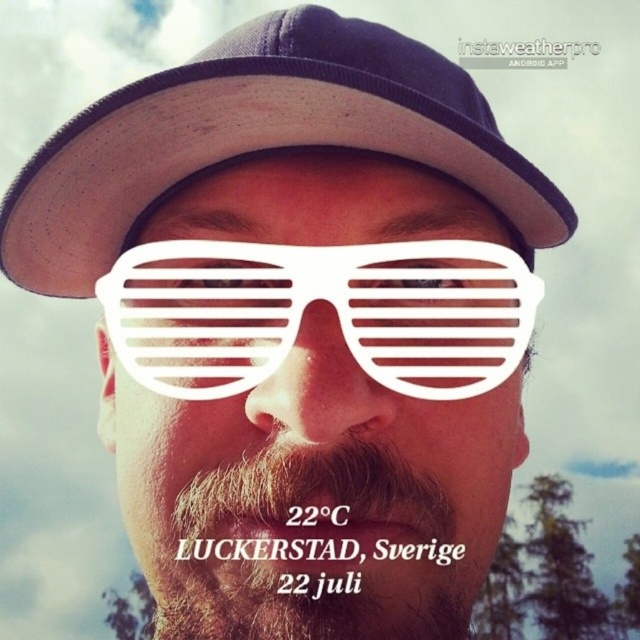
Question: Does dark blue fabric baseball hat at upper center have a lesser width compared to brownwoollybeard at lower center?

Choices:
 (A) yes
 (B) no

Answer: (B)

Question: Is dark blue fabric baseball hat at upper center to the right of white plastic sunglasses at center from the viewer's perspective?

Choices:
 (A) no
 (B) yes

Answer: (A)

Question: Observing the image, what is the correct spatial positioning of dark blue fabric baseball hat at upper center in reference to white plastic sunglasses at center?

Choices:
 (A) below
 (B) above

Answer: (B)

Question: Considering the real-world distances, which object is farthest from the brownwoollybeard at lower center?

Choices:
 (A) white plastic sunglasses at center
 (B) dark blue fabric baseball hat at upper center

Answer: (B)

Question: Among these objects, which one is farthest from the camera?

Choices:
 (A) dark blue fabric baseball hat at upper center
 (B) brownwoollybeard at lower center
 (C) white plastic sunglasses at center

Answer: (C)

Question: Among these points, which one is nearest to the camera?

Choices:
 (A) click(195, 90)
 (B) click(257, 320)
 (C) click(195, 497)

Answer: (A)